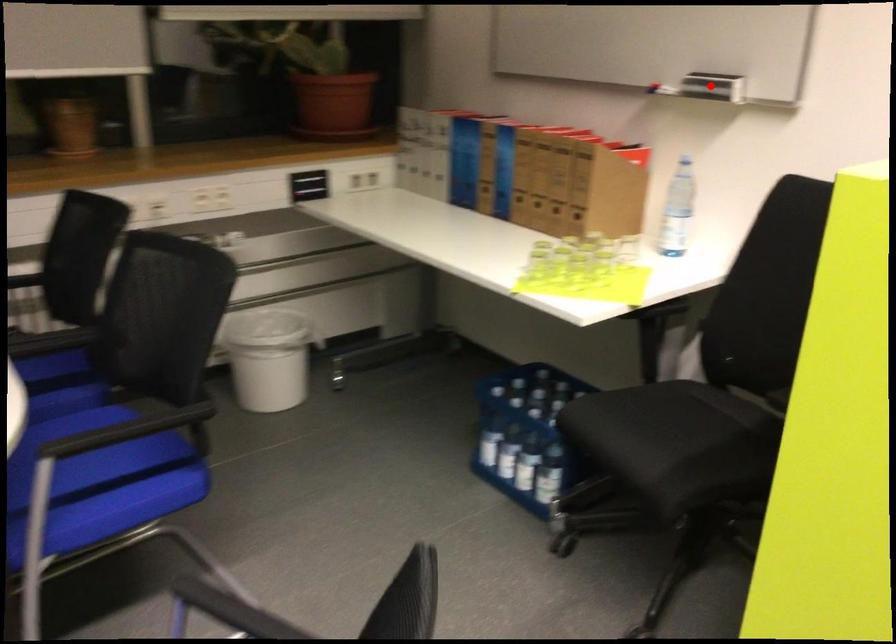
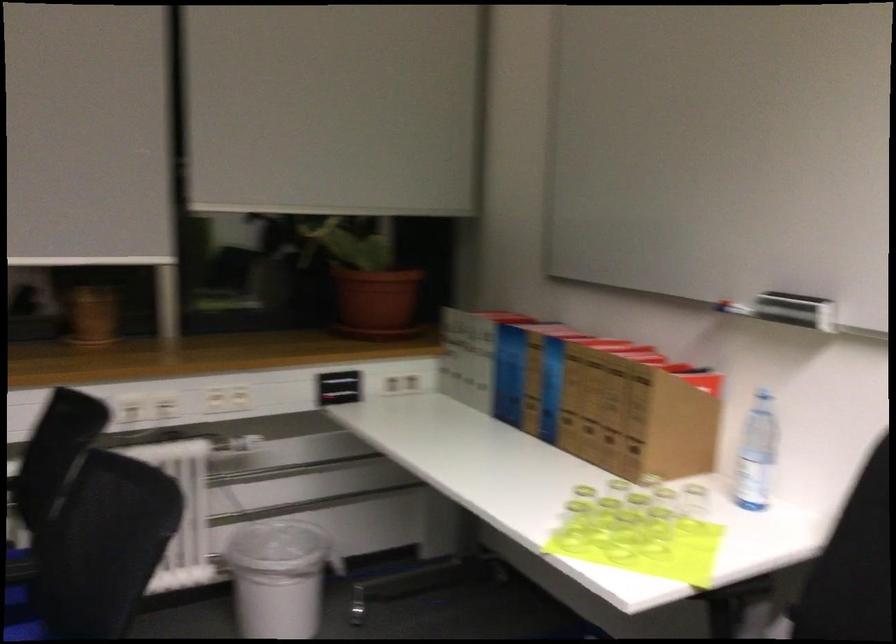
In the second image, find the point that corresponds to the highlighted location in the first image.

(795, 310)